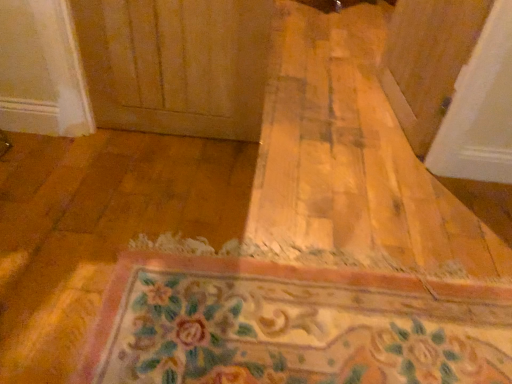
The width and height of the screenshot is (512, 384). Find the location of `vacant location behind floral carpet at center`. vacant location behind floral carpet at center is located at coordinates (305, 199).